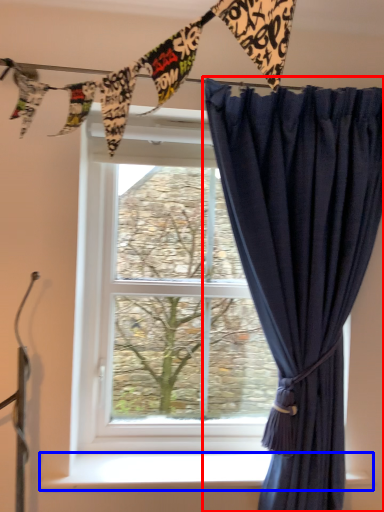
Question: Among these objects, which one is farthest to the camera, curtain (highlighted by a red box) or window sill (highlighted by a blue box)?

Choices:
 (A) curtain
 (B) window sill

Answer: (B)